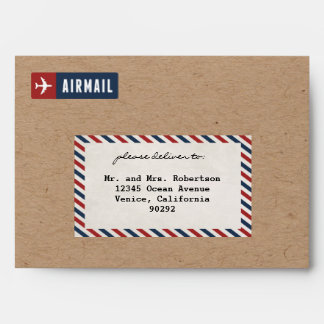
I want to click on stickers, so (x=88, y=96).